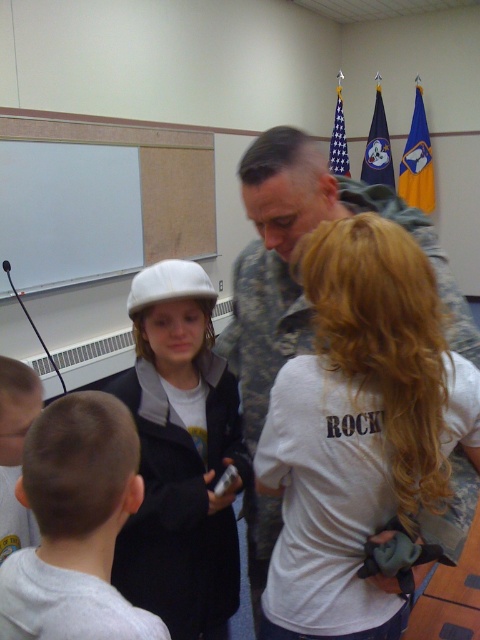
Question: Is camouflage uniform at center thinner than light brown hair at lower left?

Choices:
 (A) yes
 (B) no

Answer: (B)

Question: Which of these objects is positioned closest to the camouflage uniform at center?

Choices:
 (A) light brown hair at lower left
 (B) white matte helmet at upper left
 (C) white matte t-shirt at center

Answer: (B)

Question: Which object is closer to the camera taking this photo?

Choices:
 (A) camouflage uniform at center
 (B) white matte uniform at lower left

Answer: (B)

Question: Can you confirm if white matte t-shirt at center is smaller than white matte uniform at lower left?

Choices:
 (A) yes
 (B) no

Answer: (B)

Question: Can you confirm if white matte helmet at upper left is positioned to the right of white matte t-shirt at center?

Choices:
 (A) yes
 (B) no

Answer: (B)

Question: Considering the real-world distances, which object is farthest from the camouflage uniform at center?

Choices:
 (A) white matte helmet at upper left
 (B) light brown hair at lower left

Answer: (B)